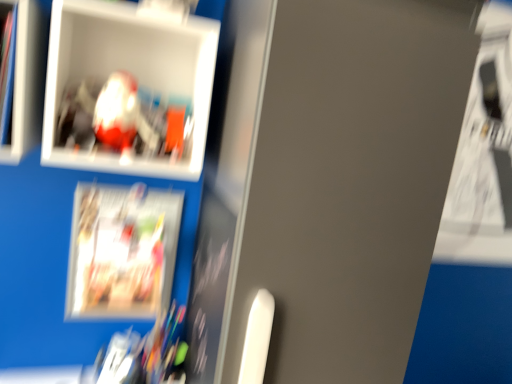
Question: Considering the relative positions of matte paper magazine at lower left and white plastic cabinet at upper left in the image provided, is matte paper magazine at lower left to the left or to the right of white plastic cabinet at upper left?

Choices:
 (A) right
 (B) left

Answer: (A)

Question: From a real-world perspective, is matte paper magazine at lower left positioned above or below white plastic cabinet at upper left?

Choices:
 (A) above
 (B) below

Answer: (B)

Question: Estimate the real-world distances between objects in this image. Which object is closer to the matte plastic picture frame at upper left?

Choices:
 (A) white plastic cabinet at upper left
 (B) matte paper magazine at lower left

Answer: (A)

Question: Which is nearer to the white plastic cabinet at upper left?

Choices:
 (A) matte paper magazine at lower left
 (B) matte plastic picture frame at upper left

Answer: (B)